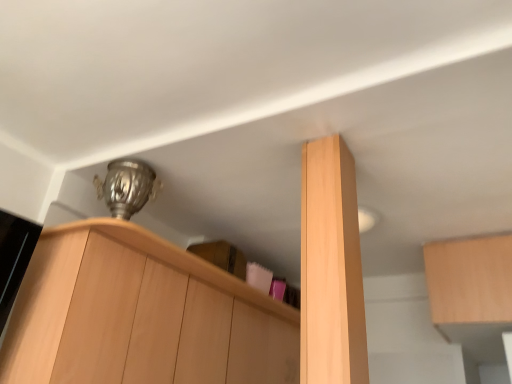
Question: Which direction should I rotate to face light wood cabinet at center, the second cabinetry when ordered from right to left, — up or down?

Choices:
 (A) down
 (B) up

Answer: (A)

Question: From a real-world perspective, is light wood cabinet at center, the second cabinetry when ordered from right to left, beneath light wood cabinet at upper right, placed as the 3th cabinetry when sorted from left to right?

Choices:
 (A) no
 (B) yes

Answer: (B)

Question: Does light wood cabinet at center, the second cabinetry when ordered from right to left, have a greater width compared to light wood cabinet at upper right, the first cabinetry positioned from the right?

Choices:
 (A) no
 (B) yes

Answer: (A)

Question: Is light wood cabinet at center, the second cabinetry when ordered from right to left, taller than light wood cabinet at upper right, placed as the 3th cabinetry when sorted from left to right?

Choices:
 (A) no
 (B) yes

Answer: (B)

Question: Would you consider light wood cabinet at center, acting as the second cabinetry starting from the left, to be distant from light wood cabinet at upper right, the first cabinetry positioned from the right?

Choices:
 (A) yes
 (B) no

Answer: (A)

Question: Is light wood cabinet at center, acting as the second cabinetry starting from the left, oriented towards light wood cabinet at upper right, the first cabinetry positioned from the right?

Choices:
 (A) no
 (B) yes

Answer: (A)

Question: Is light wood cabinet at upper right, the first cabinetry positioned from the right, inside light wood cabinet at center, the second cabinetry when ordered from right to left?

Choices:
 (A) no
 (B) yes

Answer: (A)

Question: Would you say light wood cabinet at upper left, the first cabinetry viewed from the left, is a long distance from light wood cabinet at center, the second cabinetry when ordered from right to left?

Choices:
 (A) yes
 (B) no

Answer: (B)

Question: Can you confirm if light wood cabinet at upper left, the first cabinetry viewed from the left, is positioned to the right of light wood cabinet at center, acting as the second cabinetry starting from the left?

Choices:
 (A) no
 (B) yes

Answer: (A)

Question: Is light wood cabinet at upper left, the first cabinetry viewed from the left, oriented away from light wood cabinet at center, acting as the second cabinetry starting from the left?

Choices:
 (A) no
 (B) yes

Answer: (A)

Question: From the image's perspective, is light wood cabinet at upper left, the first cabinetry viewed from the left, beneath light wood cabinet at center, acting as the second cabinetry starting from the left?

Choices:
 (A) yes
 (B) no

Answer: (A)

Question: Is light wood cabinet at upper left, which is the 3th cabinetry in right-to-left order, positioned in front of light wood cabinet at center, the second cabinetry when ordered from right to left?

Choices:
 (A) no
 (B) yes

Answer: (A)

Question: From the image's perspective, is light wood cabinet at upper left, the first cabinetry viewed from the left, located above light wood cabinet at center, the second cabinetry when ordered from right to left?

Choices:
 (A) yes
 (B) no

Answer: (B)

Question: Is light wood cabinet at center, the second cabinetry when ordered from right to left, a part of light wood cabinet at upper right, placed as the 3th cabinetry when sorted from left to right?

Choices:
 (A) yes
 (B) no

Answer: (B)